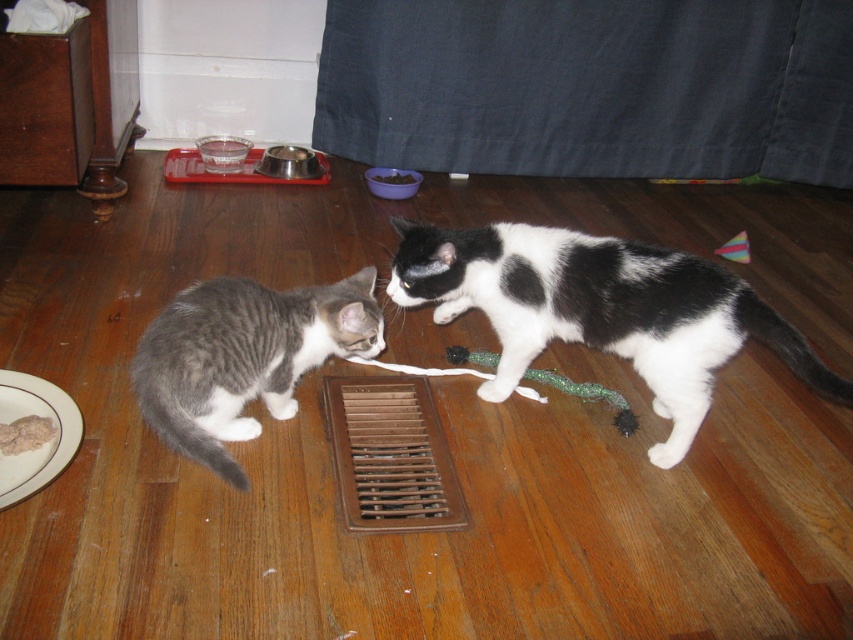
You are a cat owner who wants to ensure the cats can play safely with the green snake toy. The cats are at point (717, 348). If the cats are 1.55 meters apart, can they both reach the toy without needing to move closer than 1.5 meters?

The cats are 1.55 meters apart, which is slightly more than 1.5 meters. They can both reach the toy without needing to move closer since the distance between them allows for safe play at that distance.

Based on the photo, you are a cat owner who wants to place a new cat bed in the space between the black and white fur at center and the gray tabby cat at lower left. Based on their positions, which cat is closer to the spot where you want to put the bed?

The black and white fur at center is closer to the spot where you want to place the bed since it is positioned at the center compared to the gray tabby cat at lower left.

You are a cat owner trying to separate your two cats during playtime. You see the black and white fur at center and the gray tabby cat at lower left. Which cat should you approach first to stop the play?

You should approach the black and white fur at center first because it is closer to you than the gray tabby cat at lower left, which is further away.